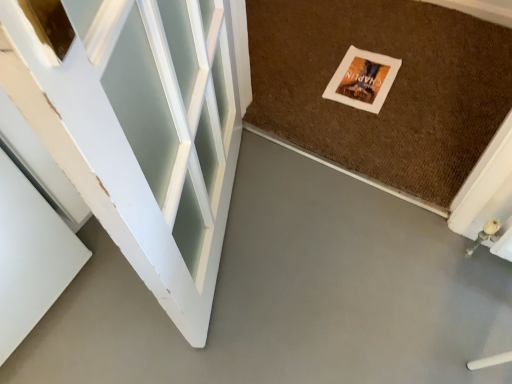
The height and width of the screenshot is (384, 512). What are the coordinates of `free spot to the left of matte paper postcard at center` in the screenshot? It's located at (302, 82).